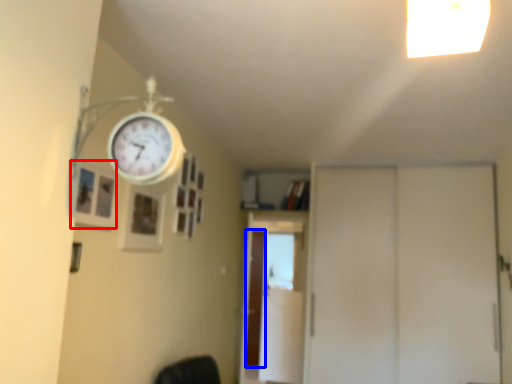
Question: Which object appears farthest to the camera in this image, picture frame (highlighted by a red box) or screen door (highlighted by a blue box)?

Choices:
 (A) picture frame
 (B) screen door

Answer: (B)